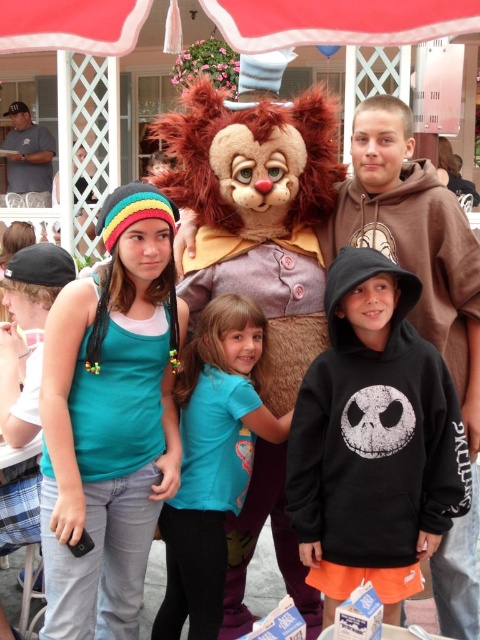
You are standing at the origin point in the image. You see two points, point (312, 512) and point (201, 492). Which point is closer to you?

Point (312, 512) is in front of point (201, 492), so it is closer to you.